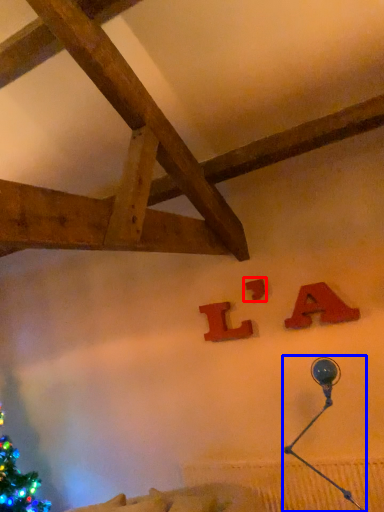
Question: Which object appears farthest to the camera in this image, alphabet (highlighted by a red box) or lamp (highlighted by a blue box)?

Choices:
 (A) alphabet
 (B) lamp

Answer: (A)